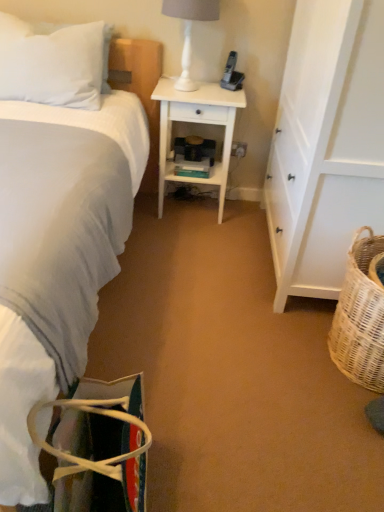
The height and width of the screenshot is (512, 384). In order to click on vacant space to the left of black plastic phone at upper center in this screenshot , I will do 199,85.